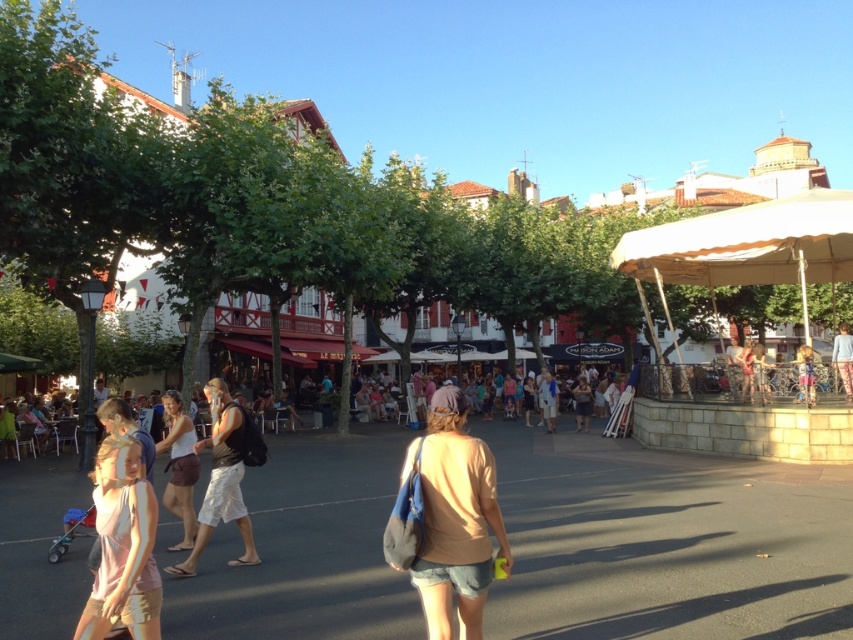
Question: Is beige fabric canopy at right above light brown shorts at center?

Choices:
 (A) no
 (B) yes

Answer: (B)

Question: Is pink cotton shirt at lower left wider than light brown shorts at center?

Choices:
 (A) yes
 (B) no

Answer: (A)

Question: Observing the image, what is the correct spatial positioning of beige fabric canopy at right in reference to light brown shorts at center?

Choices:
 (A) right
 (B) left

Answer: (A)

Question: Which object is closer to the camera taking this photo?

Choices:
 (A) light brown shorts at center
 (B) pink cotton shirt at lower left
 (C) blue denim shorts at lower right
 (D) beige fabric canopy at right

Answer: (B)

Question: Which of the following is the closest to the observer?

Choices:
 (A) blue denim shorts at lower right
 (B) beige fabric canopy at right
 (C) pink cotton shirt at lower left
 (D) white matte shorts at center

Answer: (C)

Question: Based on their relative distances, which object is farther from the beige fabric canopy at right?

Choices:
 (A) light brown shorts at center
 (B) blue denim shorts at lower right
 (C) denim shorts at center

Answer: (C)